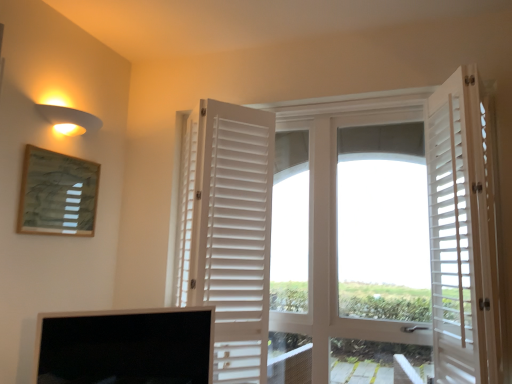
What are the coordinates of `white matte shutters at center, which is counted as the 1th door, starting from the left` in the screenshot? It's located at [234, 235].

The height and width of the screenshot is (384, 512). What do you see at coordinates (459, 231) in the screenshot? I see `white wooden shutters at right, positioned as the first door in right-to-left order` at bounding box center [459, 231].

Where is `white wooden door at center, marked as the 2th door in a left-to-right arrangement`? The width and height of the screenshot is (512, 384). white wooden door at center, marked as the 2th door in a left-to-right arrangement is located at coordinates tap(335, 230).

What is the approximate height of matte yellow wall sconce at upper left?

11.55 centimeters.

This screenshot has width=512, height=384. I want to click on wooden textured picture frame at upper left, so click(57, 194).

Consider the image. Which is nearer, (59, 232) or (248, 361)?

Point (59, 232) is positioned closer to the camera compared to point (248, 361).

Does wooden textured picture frame at upper left have a greater height compared to white wooden door at center, arranged as the 2th door when viewed from the right?

No.

Who is smaller, wooden textured picture frame at upper left or white wooden door at center, arranged as the 2th door when viewed from the right?

wooden textured picture frame at upper left is smaller.

How many degrees apart are the facing directions of wooden textured picture frame at upper left and white wooden door at center, arranged as the 2th door when viewed from the right?

wooden textured picture frame at upper left and white wooden door at center, arranged as the 2th door when viewed from the right, are facing 90.5 degrees away from each other.

Could you measure the distance between matte yellow wall sconce at upper left and white matte shutters at center, which is counted as the 1th door, starting from the left?

matte yellow wall sconce at upper left is 38.01 inches away from white matte shutters at center, which is counted as the 1th door, starting from the left.

Which of these two, matte yellow wall sconce at upper left or white matte shutters at center, the 3th door positioned from the right, is wider?

Wider between the two is white matte shutters at center, the 3th door positioned from the right.

From the image's perspective, relative to white matte shutters at center, the 3th door positioned from the right, is matte yellow wall sconce at upper left above or below?

Based on their image positions, matte yellow wall sconce at upper left is located above white matte shutters at center, the 3th door positioned from the right.

Can you tell me how much matte yellow wall sconce at upper left and white matte shutters at center, the 3th door positioned from the right, differ in facing direction?

8.2 degrees.

Does black glossy screen at lower left have a greater width compared to matte yellow wall sconce at upper left?

No.

Does black glossy screen at lower left have a lesser height compared to matte yellow wall sconce at upper left?

In fact, black glossy screen at lower left may be taller than matte yellow wall sconce at upper left.

Is black glossy screen at lower left directly adjacent to matte yellow wall sconce at upper left?

No.

Consider the image. From a real-world perspective, which is physically below, black glossy screen at lower left or matte yellow wall sconce at upper left?

black glossy screen at lower left.

Choose the correct answer: Is white wooden door at center, arranged as the 2th door when viewed from the right, inside white matte shutters at center, which is counted as the 1th door, starting from the left, or outside it?

white wooden door at center, arranged as the 2th door when viewed from the right, is not inside white matte shutters at center, which is counted as the 1th door, starting from the left, it's outside.

Considering the sizes of objects white wooden door at center, marked as the 2th door in a left-to-right arrangement, and white matte shutters at center, which is counted as the 1th door, starting from the left, in the image provided, who is wider, white wooden door at center, marked as the 2th door in a left-to-right arrangement, or white matte shutters at center, which is counted as the 1th door, starting from the left,?

Wider between the two is white matte shutters at center, which is counted as the 1th door, starting from the left.

Can you confirm if white wooden door at center, marked as the 2th door in a left-to-right arrangement, is bigger than white matte shutters at center, the 3th door positioned from the right?

Yes.

Is point (354, 229) farther from camera compared to point (224, 271)?

Yes, point (354, 229) is farther from viewer.

How distant is white wooden shutters at right, positioned as the first door in right-to-left order, from matte yellow wall sconce at upper left?

white wooden shutters at right, positioned as the first door in right-to-left order, and matte yellow wall sconce at upper left are 6.48 feet apart.

You are a GUI agent. You are given a task and a screenshot of the screen. Output one action in this format:
    pyautogui.click(x=<x>, y=<y>)
    Task: Click on the light fixture that is above the white wooden shutters at right, positioned as the first door in right-to-left order (from a real-world perspective)
    Image resolution: width=512 pixels, height=384 pixels.
    Given the screenshot: What is the action you would take?
    pyautogui.click(x=68, y=117)

Does white wooden shutters at right, positioned as the first door in right-to-left order, have a larger size compared to matte yellow wall sconce at upper left?

Correct, white wooden shutters at right, positioned as the first door in right-to-left order, is larger in size than matte yellow wall sconce at upper left.

From the picture: Between white wooden shutters at right, positioned as the first door in right-to-left order, and matte yellow wall sconce at upper left, which one has more height?

With more height is white wooden shutters at right, positioned as the first door in right-to-left order.

Is matte yellow wall sconce at upper left situated inside black glossy screen at lower left or outside?

matte yellow wall sconce at upper left exists outside the volume of black glossy screen at lower left.

Between matte yellow wall sconce at upper left and black glossy screen at lower left, which one has smaller size?

matte yellow wall sconce at upper left.

In the scene shown: Which object is positioned more to the right, matte yellow wall sconce at upper left or black glossy screen at lower left?

From the viewer's perspective, black glossy screen at lower left appears more on the right side.

Does point (77, 113) come in front of point (205, 374)?

No, (77, 113) is behind (205, 374).

Considering the relative sizes of black glossy screen at lower left and white matte shutters at center, the 3th door positioned from the right, in the image provided, is black glossy screen at lower left smaller than white matte shutters at center, the 3th door positioned from the right,?

Yes, black glossy screen at lower left is smaller than white matte shutters at center, the 3th door positioned from the right.

Based on the photo, does black glossy screen at lower left lie in front of white matte shutters at center, the 3th door positioned from the right?

That is True.

Between black glossy screen at lower left and white matte shutters at center, which is counted as the 1th door, starting from the left, which one appears on the left side from the viewer's perspective?

From the viewer's perspective, black glossy screen at lower left appears more on the left side.

The width and height of the screenshot is (512, 384). In order to click on picture frame on the left of white wooden door at center, marked as the 2th door in a left-to-right arrangement in this screenshot , I will do `click(57, 194)`.

Identify the location of the 2nd door below the matte yellow wall sconce at upper left (from a real-world perspective). This screenshot has width=512, height=384. (234, 235).

When comparing their distances from white wooden shutters at right, acting as the 3th door starting from the left, does wooden textured picture frame at upper left or white matte shutters at center, which is counted as the 1th door, starting from the left, seem further?

wooden textured picture frame at upper left is positioned further to the anchor white wooden shutters at right, acting as the 3th door starting from the left.

Looking at the image, which one is located closer to white matte shutters at center, the 3th door positioned from the right, black glossy screen at lower left or wooden textured picture frame at upper left?

Among the two, black glossy screen at lower left is located nearer to white matte shutters at center, the 3th door positioned from the right.

Estimate the real-world distances between objects in this image. Which object is closer to white wooden shutters at right, positioned as the first door in right-to-left order, black glossy screen at lower left or white wooden door at center, marked as the 2th door in a left-to-right arrangement?

Based on the image, white wooden door at center, marked as the 2th door in a left-to-right arrangement, appears to be nearer to white wooden shutters at right, positioned as the first door in right-to-left order.

When comparing their distances from black glossy screen at lower left, does matte yellow wall sconce at upper left or white wooden door at center, marked as the 2th door in a left-to-right arrangement, seem closer?

white wooden door at center, marked as the 2th door in a left-to-right arrangement.

From the image, which object appears to be farther from wooden textured picture frame at upper left, white wooden door at center, arranged as the 2th door when viewed from the right, or white matte shutters at center, which is counted as the 1th door, starting from the left?

Among the two, white wooden door at center, arranged as the 2th door when viewed from the right, is located further to wooden textured picture frame at upper left.

Which object lies further to the anchor point wooden textured picture frame at upper left, black glossy screen at lower left or white wooden shutters at right, acting as the 3th door starting from the left?

white wooden shutters at right, acting as the 3th door starting from the left.

Based on their spatial positions, is wooden textured picture frame at upper left or white wooden door at center, arranged as the 2th door when viewed from the right, further from matte yellow wall sconce at upper left?

white wooden door at center, arranged as the 2th door when viewed from the right, lies further to matte yellow wall sconce at upper left than the other object.

Estimate the real-world distances between objects in this image. Which object is closer to white matte shutters at center, the 3th door positioned from the right, wooden textured picture frame at upper left or white wooden shutters at right, acting as the 3th door starting from the left?

The object closer to white matte shutters at center, the 3th door positioned from the right, is wooden textured picture frame at upper left.

At what (x,y) coordinates should I click in order to perform the action: click on light fixture between wooden textured picture frame at upper left and white wooden door at center, arranged as the 2th door when viewed from the right, from left to right. Please return your answer as a coordinate pair (x, y). Image resolution: width=512 pixels, height=384 pixels. Looking at the image, I should click on (68, 117).

Where is `light fixture situated between wooden textured picture frame at upper left and white wooden shutters at right, positioned as the first door in right-to-left order, from left to right`? The image size is (512, 384). light fixture situated between wooden textured picture frame at upper left and white wooden shutters at right, positioned as the first door in right-to-left order, from left to right is located at coordinates (68, 117).

Identify the location of light fixture between wooden textured picture frame at upper left and white matte shutters at center, the 3th door positioned from the right, from left to right. (68, 117).

At what (x,y) coordinates should I click in order to perform the action: click on picture frame between matte yellow wall sconce at upper left and black glossy screen at lower left in the vertical direction. Please return your answer as a coordinate pair (x, y). Looking at the image, I should click on pyautogui.click(x=57, y=194).